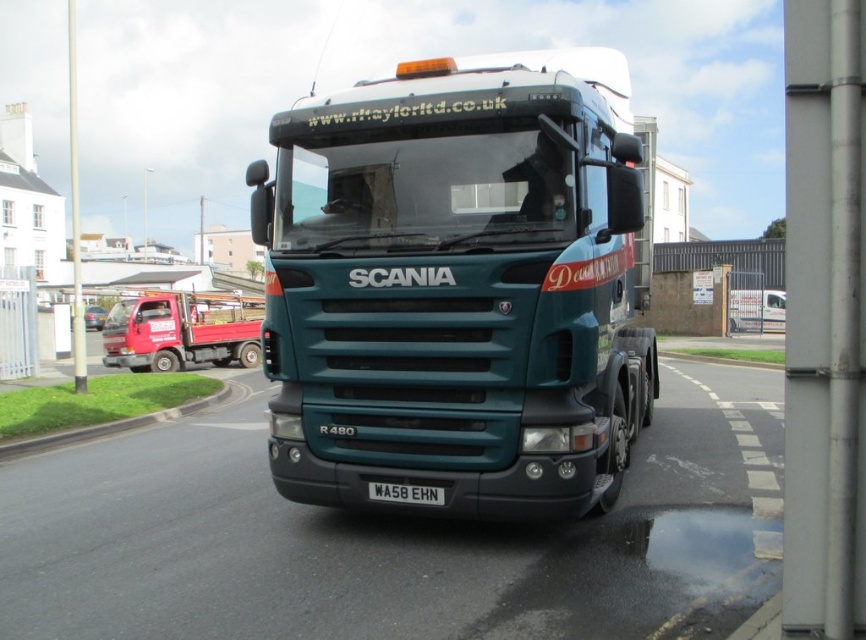
Is matte red truck at left closer to the viewer compared to black metal license plate at center?

No, it is behind black metal license plate at center.

Looking at this image, who is more forward, (x=162, y=365) or (x=404, y=484)?

Positioned in front is point (x=404, y=484).

Find the location of a particular element. This screenshot has width=866, height=640. matte red truck at left is located at coordinates (181, 332).

Between point (366, 490) and point (204, 314), which one is positioned behind?

The point (204, 314) is more distant.

Image resolution: width=866 pixels, height=640 pixels. What do you see at coordinates (456, 288) in the screenshot?
I see `teal matte truck at center` at bounding box center [456, 288].

Is point (369, 326) in front of point (205, 337)?

Yes.

Find the location of a particular element. This screenshot has width=866, height=640. teal matte truck at center is located at coordinates (456, 288).

Is point (454, 180) positioned behind point (430, 486)?

Yes, it is.

Between point (333, 428) and point (406, 496), which one is positioned behind?

The point (333, 428) is more distant.

Is point (589, 52) positioned in front of point (430, 500)?

No, it is not.

This screenshot has height=640, width=866. I want to click on teal matte truck at center, so click(456, 288).